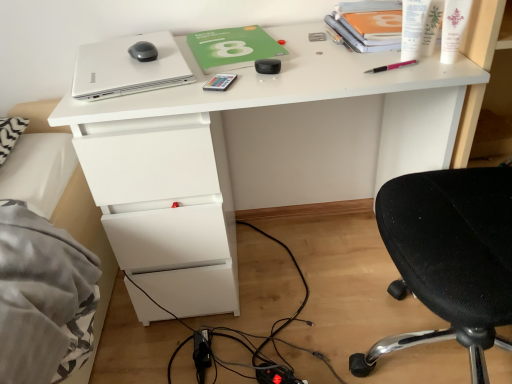
I want to click on free point above white glossy desk at center (from a real-world perspective), so click(x=254, y=51).